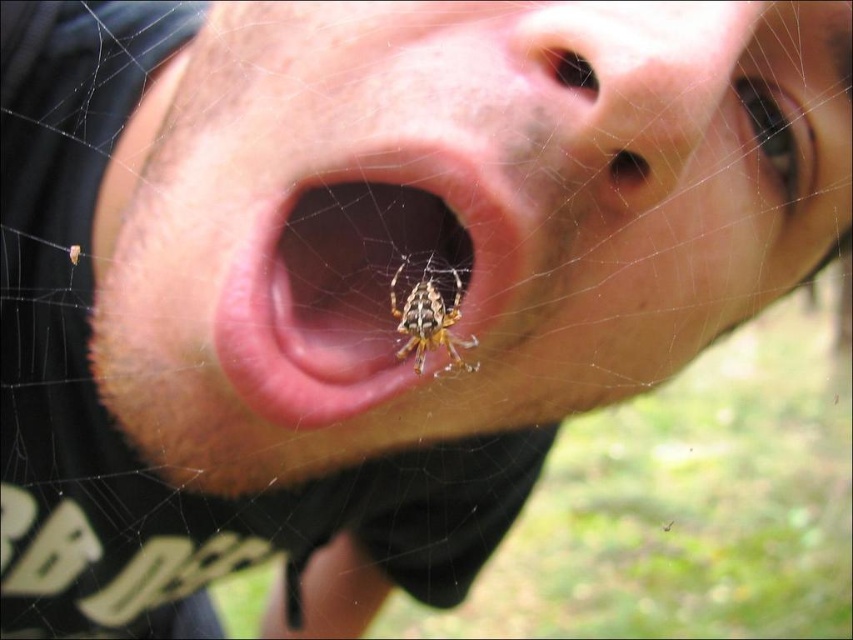
Question: From the image, what is the correct spatial relationship of pink matte/object at center in relation to smooth skin nose at center?

Choices:
 (A) below
 (B) above

Answer: (A)

Question: Which object appears farthest from the camera in this image?

Choices:
 (A) smooth skin nose at center
 (B) shiny brown spider at mouth center
 (C) pink matte/object at center

Answer: (B)

Question: Does pink matte/object at center appear on the left side of shiny brown spider at mouth center?

Choices:
 (A) yes
 (B) no

Answer: (A)

Question: Which is nearer to the smooth skin nose at center?

Choices:
 (A) pink matte/object at center
 (B) shiny brown spider at mouth center

Answer: (A)

Question: Which is farther from the pink matte/object at center?

Choices:
 (A) shiny brown spider at mouth center
 (B) smooth skin nose at center

Answer: (B)

Question: Can you confirm if smooth skin nose at center is positioned below shiny brown spider at mouth center?

Choices:
 (A) yes
 (B) no

Answer: (B)